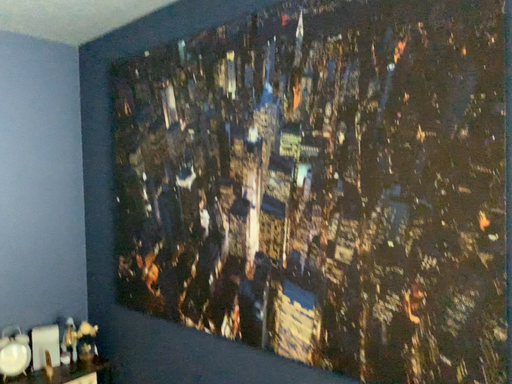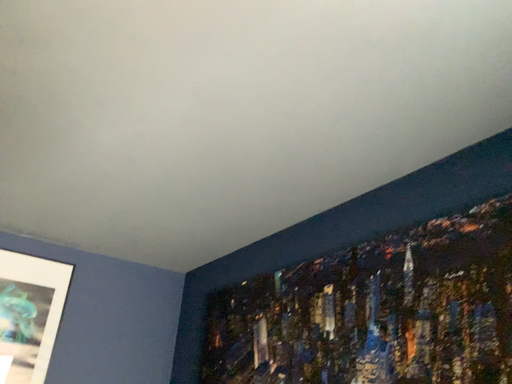
Question: How did the camera likely rotate when shooting the video?

Choices:
 (A) rotated left
 (B) rotated right

Answer: (A)